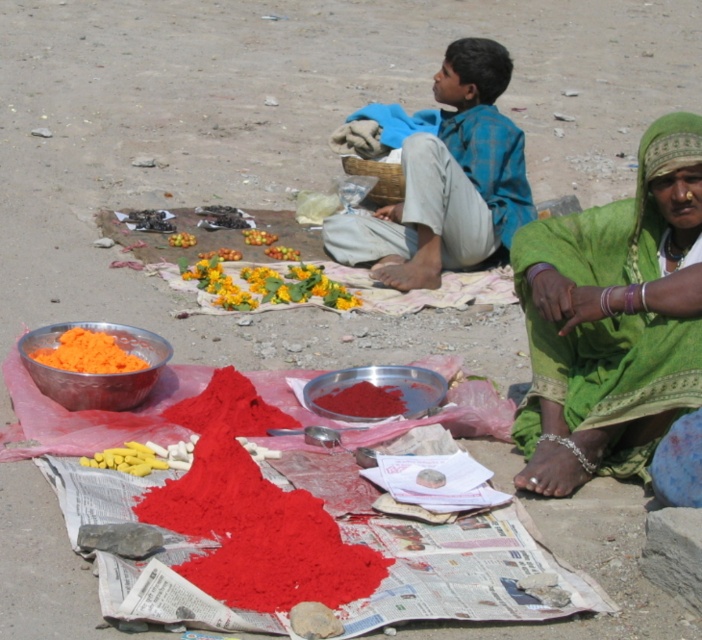
You are a photographer standing at the center of the scene. You want to place a decorative item on the green fabric at lower right to add visual interest. However, you need to ensure that the item won

The green fabric at lower right is located at point [614,320], so you can place the item there without obstructing other elements in the scene.

You are a visitor at a local market and see two items labeled as yellow fruit at center and yellow soft fruit at center. Which one is placed higher?

The yellow fruit at center is placed higher than the yellow soft fruit at center.